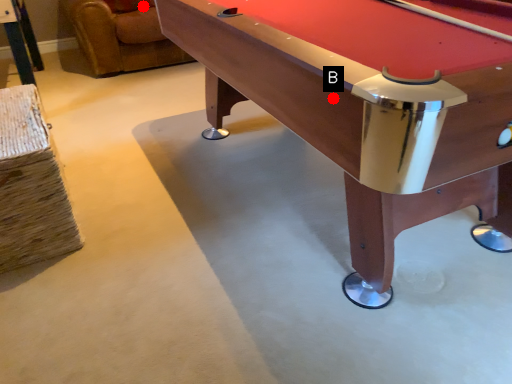
Question: Two points are circled on the image, labeled by A and B beside each circle. Which point is farther to the camera?

Choices:
 (A) A is further
 (B) B is further

Answer: (A)